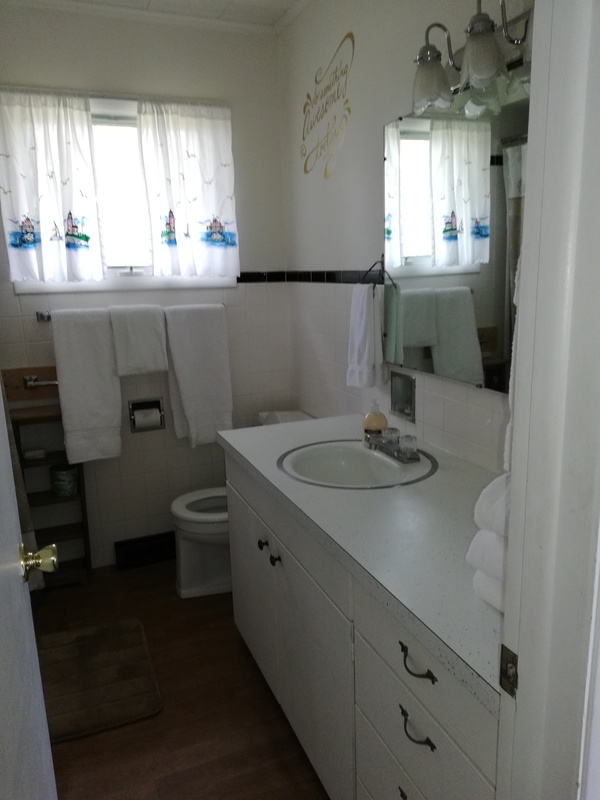
Identify the location of door handle. The width and height of the screenshot is (600, 800). (47, 562).